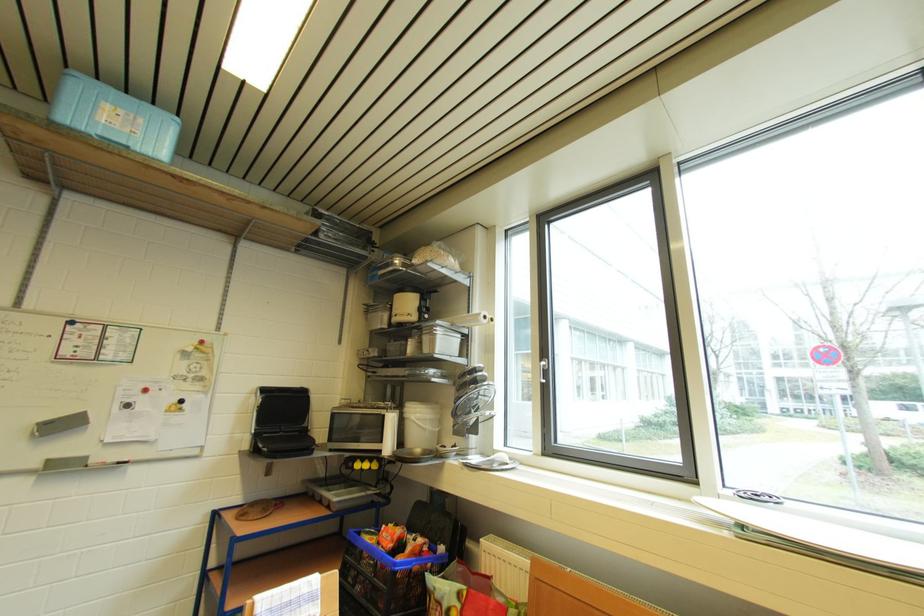
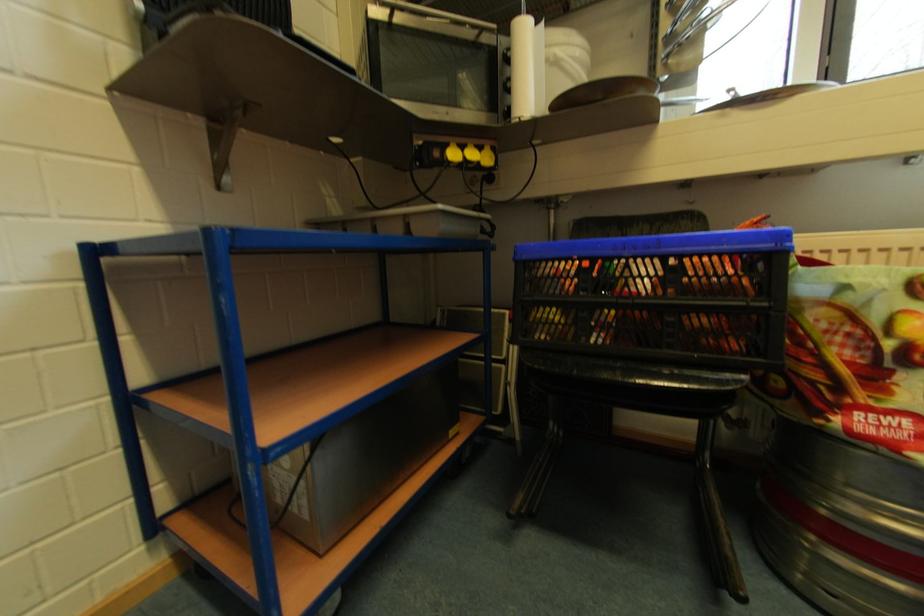
The images are taken continuously from a first-person perspective. In which direction are you moving?

The movement direction of the cameraman is left, forward.